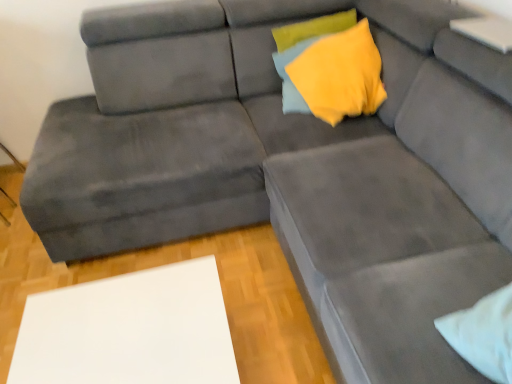
At what (x,y) coordinates should I click in order to perform the action: click on free point above white matte table at lower left (from a real-world perspective). Please return your answer as a coordinate pair (x, y). Image resolution: width=512 pixels, height=384 pixels. Looking at the image, I should click on (118, 331).